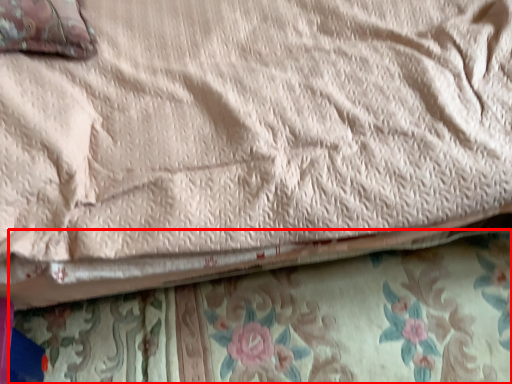
Question: In this image, where is blanket (annotated by the red box) located relative to pillow?

Choices:
 (A) right
 (B) left

Answer: (A)